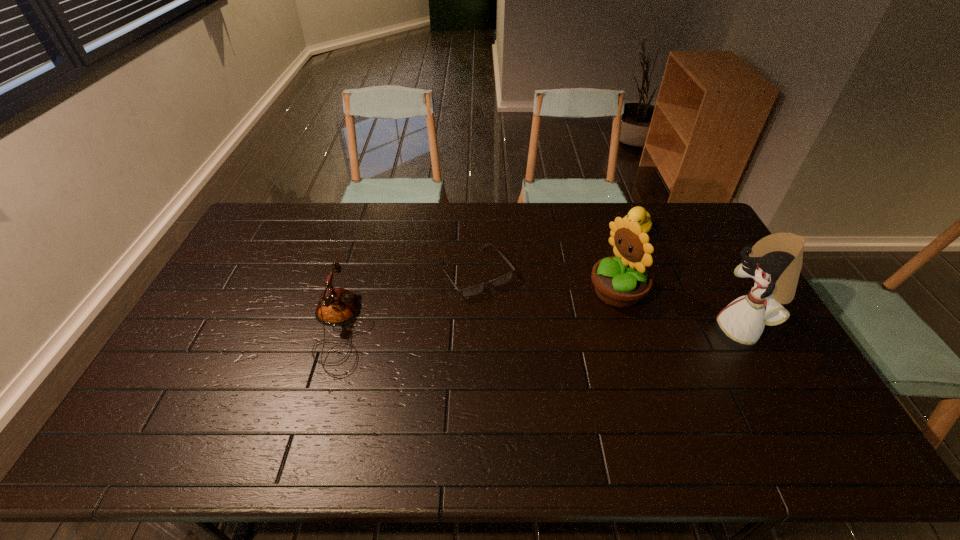
You are a GUI agent. You are given a task and a screenshot of the screen. Output one action in this format:
    pyautogui.click(x=<x>, y=<y>)
    Task: Click on the unoccupied area between the duckling and the leftmost object
    This screenshot has width=960, height=540.
    Given the screenshot: What is the action you would take?
    pyautogui.click(x=488, y=281)

Where is `free space between the leftmost object and the second tallest object`? free space between the leftmost object and the second tallest object is located at coordinates (479, 311).

Locate an element on the screen. The width and height of the screenshot is (960, 540). unoccupied position between the leftmost object and the shortest object is located at coordinates (408, 301).

Locate an element on the screen. unoccupied position between the leftmost object and the spectacles is located at coordinates (408, 301).

The height and width of the screenshot is (540, 960). I want to click on vacant space in between the shortest object and the farthest object, so click(555, 252).

The image size is (960, 540). In order to click on object that stands as the third closest to the shortest object in this screenshot , I will do `click(639, 214)`.

Choose which object is the fourth nearest neighbor to the duckling. Please provide its 2D coordinates. Your answer should be formatted as a tuple, i.e. [(x, y)], where the tuple contains the x and y coordinates of a point satisfying the conditions above.

[(337, 306)]

Image resolution: width=960 pixels, height=540 pixels. I want to click on vacant point that satisfies the following two spatial constraints: 1. on the back side of the sunflower; 2. on the left side of the duckling, so click(598, 232).

Where is `free region that satisfies the following two spatial constraints: 1. on the front side of the doll; 2. at the front face of the fourth shortest object`? Image resolution: width=960 pixels, height=540 pixels. free region that satisfies the following two spatial constraints: 1. on the front side of the doll; 2. at the front face of the fourth shortest object is located at coordinates (629, 329).

I want to click on vacant point that satisfies the following two spatial constraints: 1. on the front side of the farthest object; 2. at the front face of the doll, so pos(673,329).